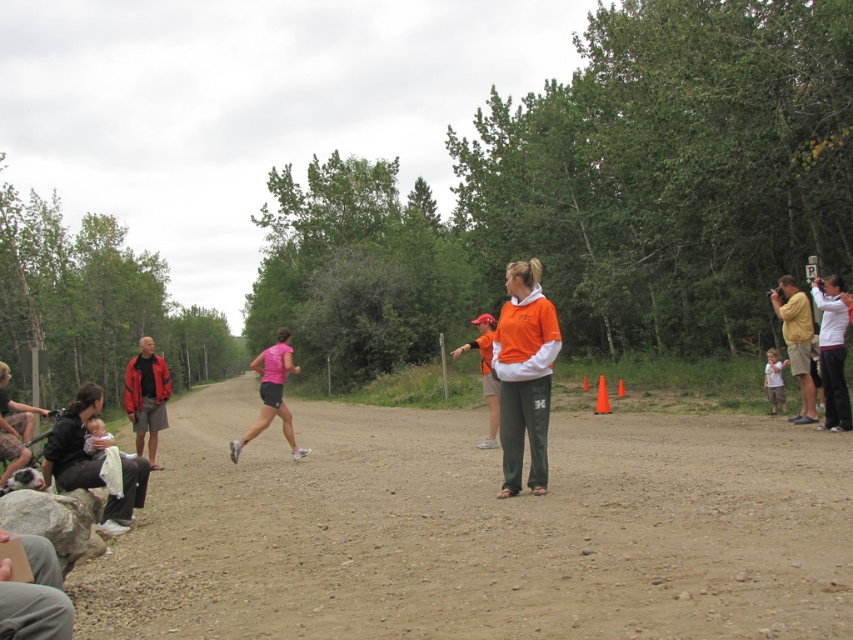
Question: Which of these objects is positioned farthest from the black fur dog at lower left?

Choices:
 (A) white matte camera at right
 (B) brown dirt field at center
 (C) pink fabric shorts at center

Answer: (A)

Question: Among these points, which one is farthest from the camera?

Choices:
 (A) (786, 304)
 (B) (154, 371)
 (C) (769, 400)

Answer: (C)

Question: Is brown dirt field at center below matte red jacket at left?

Choices:
 (A) no
 (B) yes

Answer: (B)

Question: Does brown dirt field at center have a lesser width compared to orange fabric shirt at center?

Choices:
 (A) yes
 (B) no

Answer: (B)

Question: Which object is the farthest from the yellow cotton shirt at right?

Choices:
 (A) orange fabric shirt at center
 (B) white matte camera at right
 (C) brown dirt field at center
 (D) matte red jacket at left

Answer: (D)

Question: Is matte red jacket at left further to camera compared to pink fabric shorts at center?

Choices:
 (A) yes
 (B) no

Answer: (A)